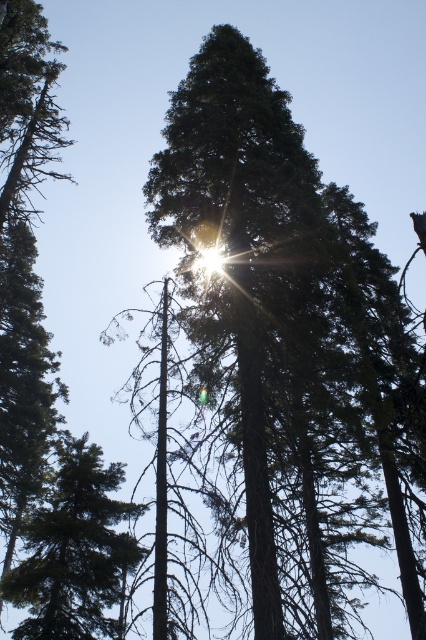
Question: Which point is closer to the camera taking this photo?

Choices:
 (A) (34, 548)
 (B) (34, 88)

Answer: (A)

Question: Can you confirm if green matte tree at lower left is thinner than green matte tree at upper left?

Choices:
 (A) yes
 (B) no

Answer: (A)

Question: Does green matte tree at lower left appear under green matte tree at upper left?

Choices:
 (A) no
 (B) yes

Answer: (B)

Question: Which of the following is the farthest from the observer?

Choices:
 (A) (5, 3)
 (B) (83, 611)

Answer: (B)

Question: Which point is farther to the camera?

Choices:
 (A) (25, 200)
 (B) (54, 541)

Answer: (A)

Question: Does green matte tree at lower left appear on the left side of green matte tree at upper left?

Choices:
 (A) yes
 (B) no

Answer: (B)